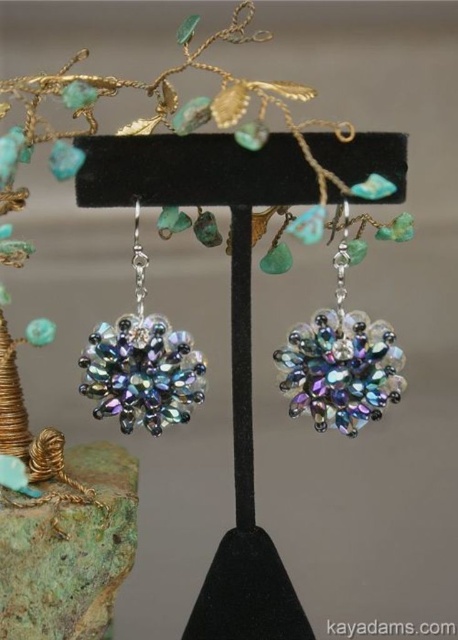
Between point (396, 381) and point (99, 396), which one is positioned behind?

Positioned behind is point (99, 396).

Which is in front, point (332, 336) or point (178, 362)?

Point (332, 336)

Which is behind, point (347, 339) or point (187, 339)?

The point (187, 339) is behind.

Locate an element on the screen. This screenshot has height=640, width=458. iridescent glass earrings at center is located at coordinates coord(342,356).